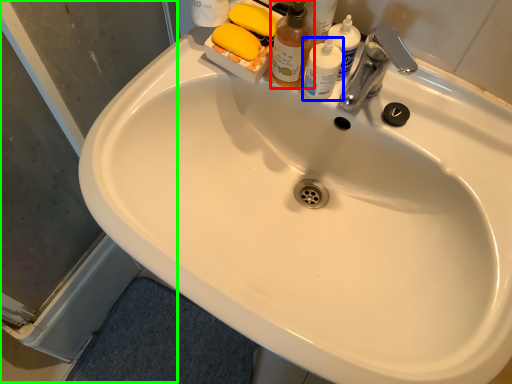
Question: Which object is the closest to the cleaning product (highlighted by a red box)? Choose among these: toiletry (highlighted by a blue box) or screen door (highlighted by a green box).

Choices:
 (A) toiletry
 (B) screen door

Answer: (A)